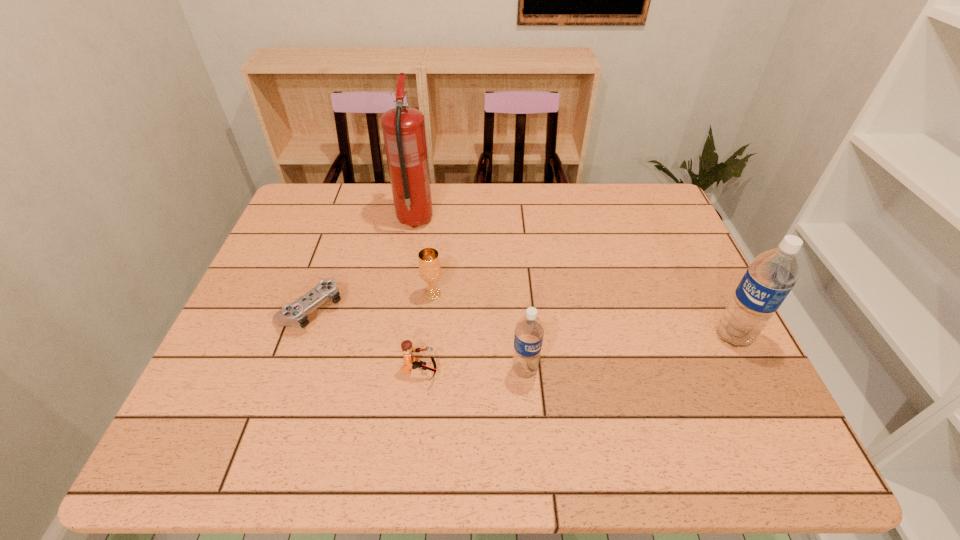
Locate an element on the screen. This screenshot has height=540, width=960. vacant region that satisfies the following two spatial constraints: 1. on the front side of the control; 2. on the right side of the left water bottle is located at coordinates (290, 369).